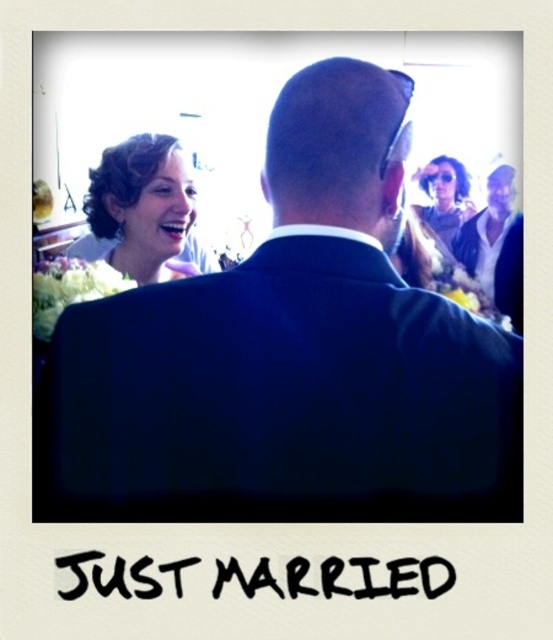
Between point (304, 344) and point (101, 257), which one is positioned behind?

Positioned behind is point (101, 257).

Between point (492, 419) and point (160, 168), which one is positioned in front?

Positioned in front is point (492, 419).

What are the coordinates of `dark blue suit at center` in the screenshot? It's located at (291, 355).

Based on the photo, measure the distance between point (336, 308) and camera.

29.50 inches

Who is more distant from viewer, (358, 400) or (440, 163)?

The point (440, 163) is behind.

The height and width of the screenshot is (640, 553). I want to click on dark blue suit at center, so click(x=291, y=355).

The height and width of the screenshot is (640, 553). In order to click on dark blue suit at center in this screenshot , I will do `click(291, 355)`.

Is point (118, 268) positioned before point (456, 179)?

Yes, it is in front of point (456, 179).

Which is in front, point (101, 161) or point (418, 176)?

Point (101, 161) is more forward.

Where is `blonde hair at upper left`? The image size is (553, 640). blonde hair at upper left is located at coordinates (143, 211).